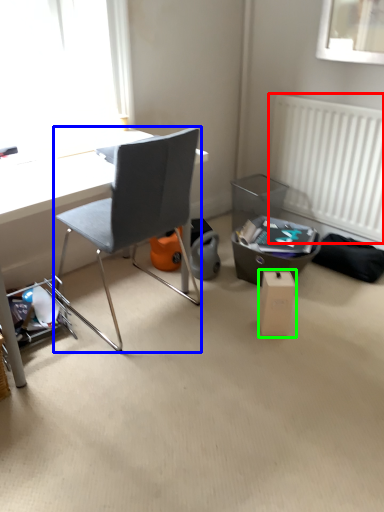
Question: Which object is the farthest from radiator (highlighted by a red box)? Choose among these: chair (highlighted by a blue box) or cardboard box (highlighted by a green box).

Choices:
 (A) chair
 (B) cardboard box

Answer: (A)